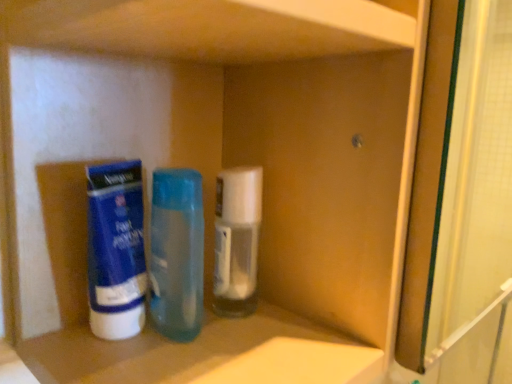
Question: Which direction should I rotate to look at white plastic container at center, the second bottle from the left, — up or down?

Choices:
 (A) down
 (B) up

Answer: (A)

Question: Is blue matte tube at left thinner than translucent plastic bottle at center, the 2th bottle viewed from the right?

Choices:
 (A) no
 (B) yes

Answer: (B)

Question: Considering the relative positions of blue matte tube at left and translucent plastic bottle at center, positioned as the 1th bottle in left-to-right order, in the image provided, is blue matte tube at left behind translucent plastic bottle at center, positioned as the 1th bottle in left-to-right order,?

Choices:
 (A) no
 (B) yes

Answer: (A)

Question: Is blue matte tube at left bigger than translucent plastic bottle at center, the 2th bottle viewed from the right?

Choices:
 (A) no
 (B) yes

Answer: (A)

Question: Does blue matte tube at left appear on the left side of translucent plastic bottle at center, positioned as the 1th bottle in left-to-right order?

Choices:
 (A) yes
 (B) no

Answer: (A)

Question: Would you say blue matte tube at left is a long distance from translucent plastic bottle at center, positioned as the 1th bottle in left-to-right order?

Choices:
 (A) no
 (B) yes

Answer: (A)

Question: Does blue matte tube at left have a greater width compared to translucent plastic bottle at center, positioned as the 1th bottle in left-to-right order?

Choices:
 (A) no
 (B) yes

Answer: (A)

Question: Is white plastic container at center, acting as the first bottle starting from the right, far from blue matte tube at left?

Choices:
 (A) yes
 (B) no

Answer: (B)

Question: Is white plastic container at center, acting as the first bottle starting from the right, taller than blue matte tube at left?

Choices:
 (A) yes
 (B) no

Answer: (B)

Question: Is the position of white plastic container at center, the second bottle from the left, less distant than that of blue matte tube at left?

Choices:
 (A) no
 (B) yes

Answer: (A)

Question: Is white plastic container at center, the second bottle from the left, wider than blue matte tube at left?

Choices:
 (A) yes
 (B) no

Answer: (A)

Question: Does white plastic container at center, the second bottle from the left, have a lesser height compared to blue matte tube at left?

Choices:
 (A) yes
 (B) no

Answer: (A)

Question: From a real-world perspective, is white plastic container at center, acting as the first bottle starting from the right, located higher than blue matte tube at left?

Choices:
 (A) yes
 (B) no

Answer: (A)

Question: Can you confirm if translucent plastic bottle at center, positioned as the 1th bottle in left-to-right order, is wider than blue matte tube at left?

Choices:
 (A) no
 (B) yes

Answer: (B)